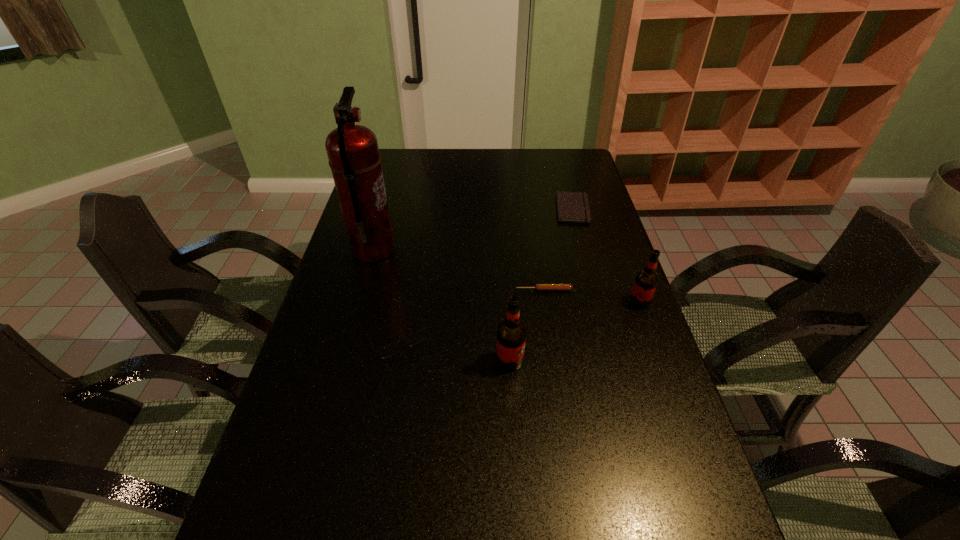
Where is `the second tallest object`? the second tallest object is located at coordinates (511, 334).

Identify the location of the left root beer. The height and width of the screenshot is (540, 960). (511, 334).

This screenshot has width=960, height=540. I want to click on the right root beer, so click(x=646, y=280).

I want to click on the third tallest object, so (646, 280).

This screenshot has width=960, height=540. I want to click on the shortest object, so click(x=573, y=207).

Identify the location of checkbook. (573, 207).

Where is `the fourth tallest object`? The height and width of the screenshot is (540, 960). the fourth tallest object is located at coordinates (391, 349).

Locate an element on the screen. The width and height of the screenshot is (960, 540). fire extinguisher is located at coordinates (353, 152).

Image resolution: width=960 pixels, height=540 pixels. What are the coordinates of `the fifth nearest object` in the screenshot? It's located at (353, 152).

Find the location of `sausage`. sausage is located at coordinates (538, 287).